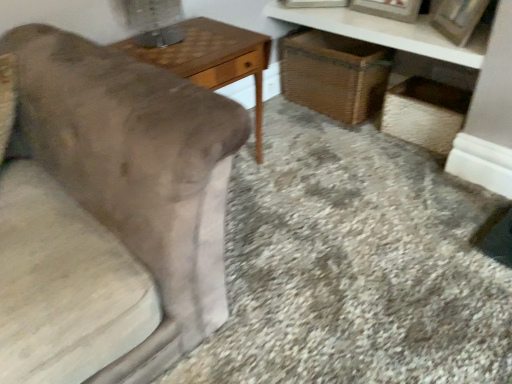
Where is `velvet beige couch at left`? velvet beige couch at left is located at coordinates click(x=136, y=172).

Find the location of a particular element. The height and width of the screenshot is (384, 512). metallic silver table lamp at upper left is located at coordinates (153, 21).

Measure the distance between woven straw basket at lower right and camera.

The depth of woven straw basket at lower right is 5.80 feet.

Image resolution: width=512 pixels, height=384 pixels. Describe the element at coordinates (425, 113) in the screenshot. I see `woven straw basket at lower right` at that location.

This screenshot has width=512, height=384. Describe the element at coordinates (458, 19) in the screenshot. I see `wooden picture frame at upper right` at that location.

Find the location of a particular element. The width and height of the screenshot is (512, 384). wooden picture frame at upper right is located at coordinates (458, 19).

At what (x,y) coordinates should I click in order to perform the action: click on velvet beige couch at left. Please return your answer as a coordinate pair (x, y). This screenshot has height=384, width=512. Looking at the image, I should click on [136, 172].

Is metallic silver table lamp at upper left not inside brown wicker basket at center?

Yes, metallic silver table lamp at upper left is not within brown wicker basket at center.

Would you consider metallic silver table lamp at upper left to be distant from brown wicker basket at center?

Actually, metallic silver table lamp at upper left and brown wicker basket at center are a little close together.

Considering the relative positions of metallic silver table lamp at upper left and brown wicker basket at center in the image provided, is metallic silver table lamp at upper left in front of brown wicker basket at center?

That is True.

Can you confirm if metallic silver table lamp at upper left is taller than brown wicker basket at center?

Incorrect, the height of metallic silver table lamp at upper left is not larger of that of brown wicker basket at center.

Based on the photo, which object is positioned more to the right, brown wicker basket at center or woodenobject at left?

brown wicker basket at center is more to the right.

Could you tell me if brown wicker basket at center is turned towards woodenobject at left?

Yes, brown wicker basket at center is facing woodenobject at left.

From the image's perspective, is brown wicker basket at center above woodenobject at left?

Yes, from the image's perspective, brown wicker basket at center is on top of woodenobject at left.

Find the location of a particular element. This screenshot has width=512, height=384. basket above the woodenobject at left (from the image's perspective) is located at coordinates (334, 74).

Can you confirm if woven straw basket at lower right is wider than wooden picture frame at upper right?

Indeed, woven straw basket at lower right has a greater width compared to wooden picture frame at upper right.

Considering the sizes of woven straw basket at lower right and wooden picture frame at upper right in the image, is woven straw basket at lower right bigger or smaller than wooden picture frame at upper right?

woven straw basket at lower right is bigger than wooden picture frame at upper right.

Could you tell me if woven straw basket at lower right is turned towards wooden picture frame at upper right?

No, woven straw basket at lower right is not facing towards wooden picture frame at upper right.

Is the depth of wooden picture frame at upper right greater than that of brown wicker basket at center?

No, wooden picture frame at upper right is in front of brown wicker basket at center.

From a real-world perspective, is wooden picture frame at upper right physically located above or below brown wicker basket at center?

wooden picture frame at upper right is situated higher than brown wicker basket at center in the real world.

Is there a large distance between wooden picture frame at upper right and brown wicker basket at center?

No, there isn't a large distance between wooden picture frame at upper right and brown wicker basket at center.

Is brown wicker basket at center wider or thinner than metallic silver table lamp at upper left?

In the image, brown wicker basket at center appears to be wider than metallic silver table lamp at upper left.

Considering the positions of points (333, 93) and (155, 18), is point (333, 93) farther from camera compared to point (155, 18)?

Yes, it is.

Looking at this image, can you tell me how much brown wicker basket at center and metallic silver table lamp at upper left differ in facing direction?

There is a 90.7-degree angle between the facing directions of brown wicker basket at center and metallic silver table lamp at upper left.

From the picture: Is brown wicker basket at center to the left of metallic silver table lamp at upper left from the viewer's perspective?

Incorrect, brown wicker basket at center is not on the left side of metallic silver table lamp at upper left.

From a real-world perspective, is velvet beige couch at left above or below woven wicker vanity at upper right?

In terms of real-world spatial position, velvet beige couch at left is below woven wicker vanity at upper right.

Between velvet beige couch at left and woven wicker vanity at upper right, which one appears on the right side from the viewer's perspective?

Positioned to the right is woven wicker vanity at upper right.

Looking at this image, is velvet beige couch at left turned away from woven wicker vanity at upper right?

No.

Does point (405, 118) lie in front of point (360, 70)?

Yes, point (405, 118) is closer to viewer.

Is woven straw basket at lower right directly adjacent to brown wicker basket at center?

No, woven straw basket at lower right is not touching brown wicker basket at center.

Is woven straw basket at lower right positioned with its back to brown wicker basket at center?

No, woven straw basket at lower right is not facing away from brown wicker basket at center.

The height and width of the screenshot is (384, 512). Find the location of `basket behind the metallic silver table lamp at upper left`. basket behind the metallic silver table lamp at upper left is located at coordinates (334, 74).

I want to click on table located below the brown wicker basket at center (from the image's perspective), so click(x=213, y=59).

When comparing their distances from brown wicker basket at center, does metallic silver table lamp at upper left or woodenobject at left seem closer?

woodenobject at left lies closer to brown wicker basket at center than the other object.

From the image, which object appears to be nearer to woven wicker vanity at upper right, brown wicker basket at center or velvet beige couch at left?

brown wicker basket at center is positioned closer to the anchor woven wicker vanity at upper right.

When comparing their distances from woven straw basket at lower right, does brown wicker basket at center or metallic silver table lamp at upper left seem further?

metallic silver table lamp at upper left is further to woven straw basket at lower right.

When comparing their distances from woven straw basket at lower right, does velvet beige couch at left or woodenobject at left seem further?

Based on the image, velvet beige couch at left appears to be further to woven straw basket at lower right.

Considering their positions, is woodenobject at left positioned further to velvet beige couch at left than woven wicker vanity at upper right?

woven wicker vanity at upper right.

Looking at the image, which one is located further to metallic silver table lamp at upper left, woven straw basket at lower right or wooden picture frame at upper right?

The object further to metallic silver table lamp at upper left is wooden picture frame at upper right.

Considering their positions, is brown wicker basket at center positioned closer to woven straw basket at lower right than wooden picture frame at upper right?

brown wicker basket at center.

Looking at the image, which one is located closer to metallic silver table lamp at upper left, woven straw basket at lower right or woven wicker vanity at upper right?

Based on the image, woven wicker vanity at upper right appears to be nearer to metallic silver table lamp at upper left.

Identify the location of basket between metallic silver table lamp at upper left and woven wicker vanity at upper right from left to right. click(334, 74).

Locate an element on the screen. The width and height of the screenshot is (512, 384). table lamp between velvet beige couch at left and woven wicker vanity at upper right is located at coordinates (153, 21).

Locate an element on the screen. This screenshot has height=384, width=512. vanity between metallic silver table lamp at upper left and wooden picture frame at upper right is located at coordinates (387, 32).

Locate an element on the screen. The height and width of the screenshot is (384, 512). vanity located between woodenobject at left and woven straw basket at lower right in the left-right direction is located at coordinates (387, 32).